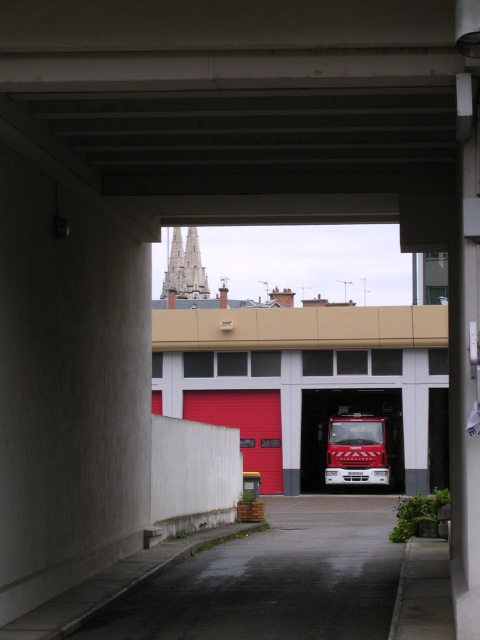
In the scene shown: You are a delivery driver who needs to enter the fire station through the doorway. The beige concrete overpass at center and the red metallic fire truck at center are in your path. Which object will you encounter first as you drive into the fire station?

The beige concrete overpass at center is positioned on the left side of the red metallic fire truck at center, so you will encounter the beige concrete overpass at center first before reaching the red metallic fire truck at center.

You are a firefighter trying to exit the building through the doorway. You see the red matte fire truck at center and the red metallic fire truck at center. Which one is closer to the right side of the doorway?

The red metallic fire truck at center is closer to the right side of the doorway because the red matte fire truck at center is positioned to its left.

Based on the photo, you are a delivery driver who needs to enter the fire station through the doorway. The red matte fire truck at center and the beige concrete overpass at center are in your path. Based on their sizes, which object might block your path more significantly?

The red matte fire truck at center is larger in size than the beige concrete overpass at center, so it would block the path more significantly.